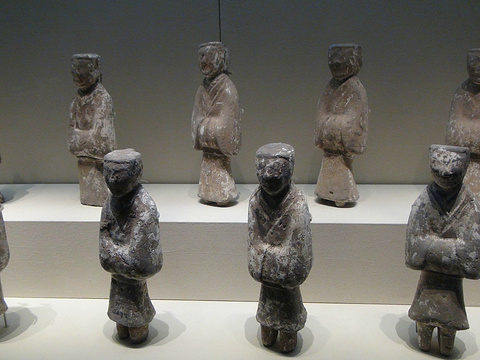
Locate an element on the screen. statue is located at coordinates (88, 129), (222, 128), (337, 128), (470, 128), (444, 239), (288, 257), (143, 261).